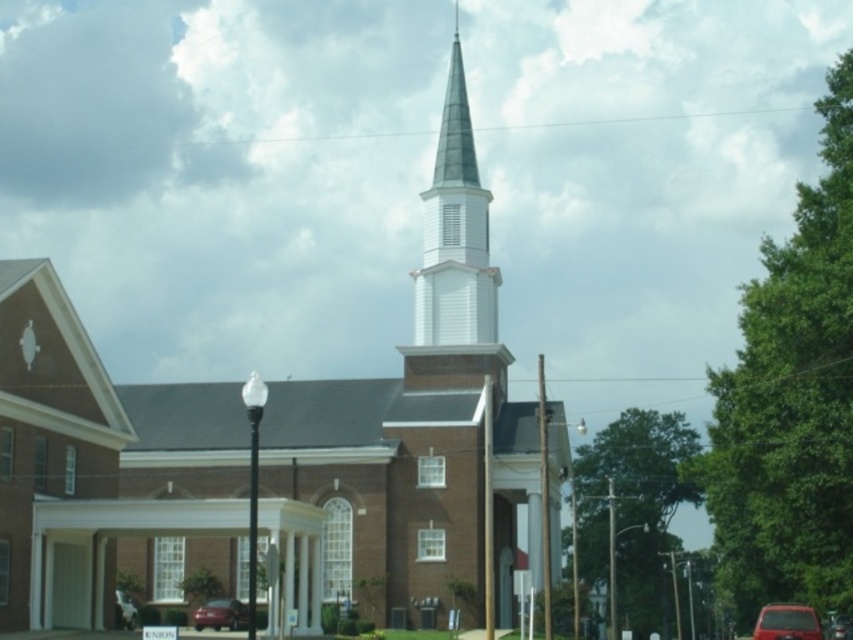
You are standing at the entrance of the church and looking towards the streetlamp. There are two points marked in the image, point (459, 150) and point (842, 618). Which point is closer to you?

Point (459, 150) is behind point (842, 618), so point (842, 618) is closer to you.